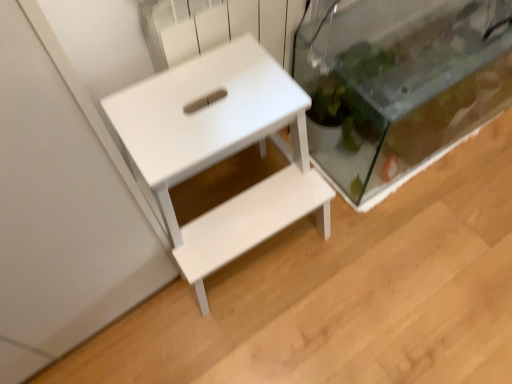
Question: Is transparent glass tank at right aimed at white matte table at center?

Choices:
 (A) yes
 (B) no

Answer: (B)

Question: Does transparent glass tank at right have a greater width compared to white matte table at center?

Choices:
 (A) no
 (B) yes

Answer: (A)

Question: From the image's perspective, is transparent glass tank at right beneath white matte table at center?

Choices:
 (A) no
 (B) yes

Answer: (A)

Question: Is transparent glass tank at right looking in the opposite direction of white matte table at center?

Choices:
 (A) yes
 (B) no

Answer: (B)

Question: From a real-world perspective, is transparent glass tank at right on top of white matte table at center?

Choices:
 (A) yes
 (B) no

Answer: (B)

Question: Does transparent glass tank at right have a greater height compared to white matte table at center?

Choices:
 (A) no
 (B) yes

Answer: (A)

Question: Is white matte table at center wider than transparent glass tank at right?

Choices:
 (A) no
 (B) yes

Answer: (B)

Question: From the image's perspective, does white matte table at center appear lower than transparent glass tank at right?

Choices:
 (A) yes
 (B) no

Answer: (A)

Question: Is transparent glass tank at right located within white matte table at center?

Choices:
 (A) yes
 (B) no

Answer: (B)

Question: Does white matte table at center turn towards transparent glass tank at right?

Choices:
 (A) no
 (B) yes

Answer: (A)

Question: Does white matte table at center have a lesser height compared to transparent glass tank at right?

Choices:
 (A) yes
 (B) no

Answer: (B)

Question: Is white matte table at center positioned behind transparent glass tank at right?

Choices:
 (A) no
 (B) yes

Answer: (A)

Question: In terms of width, does white matte table at center look wider or thinner when compared to transparent glass tank at right?

Choices:
 (A) wide
 (B) thin

Answer: (A)